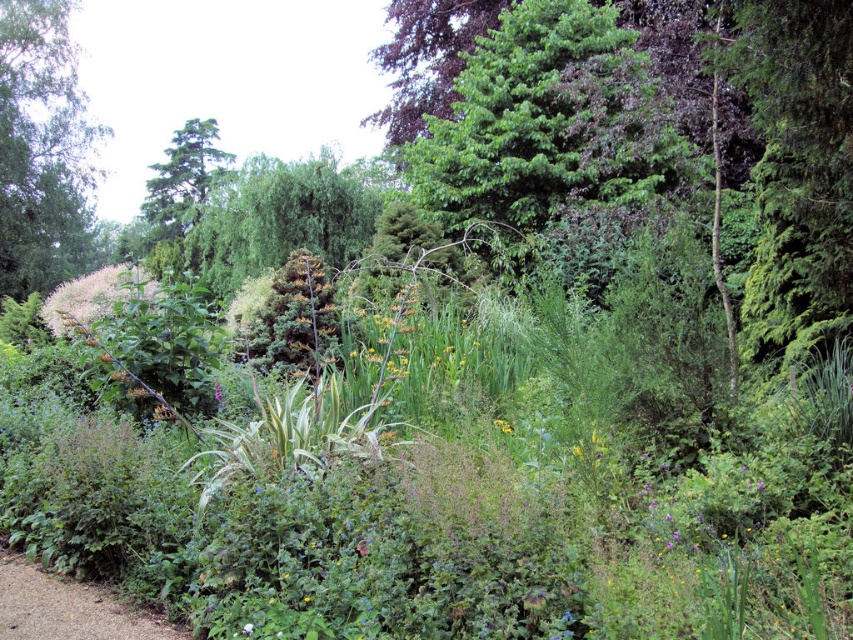
Does gravel path at lower left appear on the left side of white fluffy flower at center?

Yes, gravel path at lower left is to the left of white fluffy flower at center.

Is gravel path at lower left bigger than white fluffy flower at center?

Correct, gravel path at lower left is larger in size than white fluffy flower at center.

Which is in front, point (73, 621) or point (248, 628)?

Positioned in front is point (248, 628).

Where is `gravel path at lower left`? Image resolution: width=853 pixels, height=640 pixels. gravel path at lower left is located at coordinates (68, 608).

Does green leafy tree at upper left appear over gravel path at lower left?

Indeed, green leafy tree at upper left is positioned over gravel path at lower left.

Who is more forward, (51, 22) or (35, 592)?

Positioned in front is point (35, 592).

Identify the location of green leafy tree at upper left. (41, 150).

Between green leafy tree at upper left and white fluffy flower at center, which one is positioned higher?

green leafy tree at upper left is higher up.

Is green leafy tree at upper left smaller than white fluffy flower at center?

No.

What do you see at coordinates (41, 150) in the screenshot?
I see `green leafy tree at upper left` at bounding box center [41, 150].

Find the location of `green leafy tree at upper left`. green leafy tree at upper left is located at coordinates (41, 150).